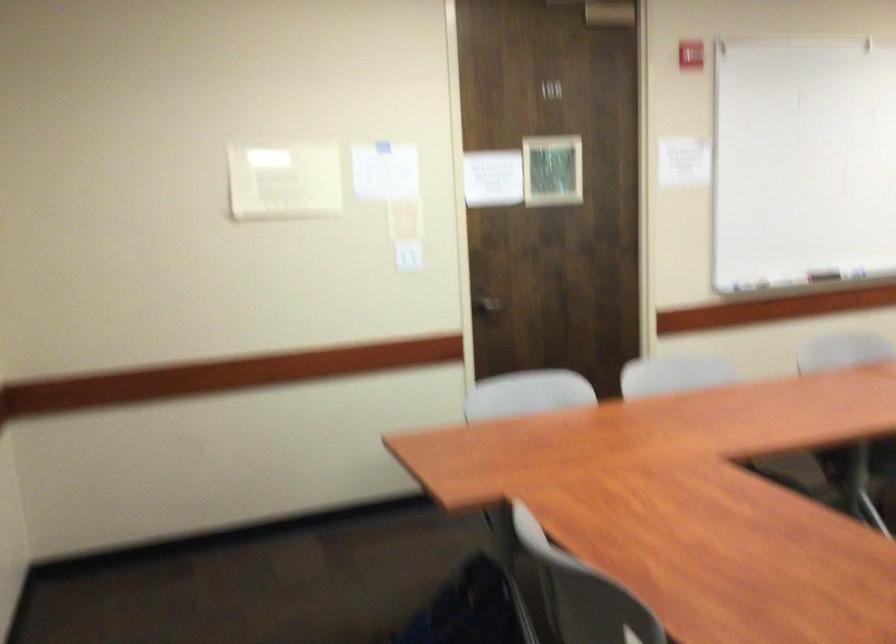
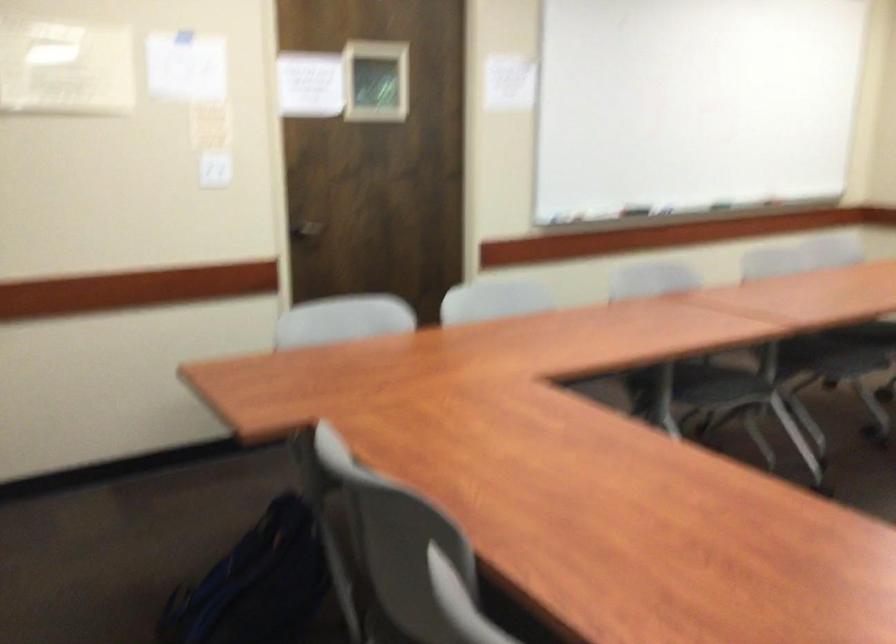
In the second image, find the point that corresponds to (x=410, y=252) in the first image.

(214, 169)